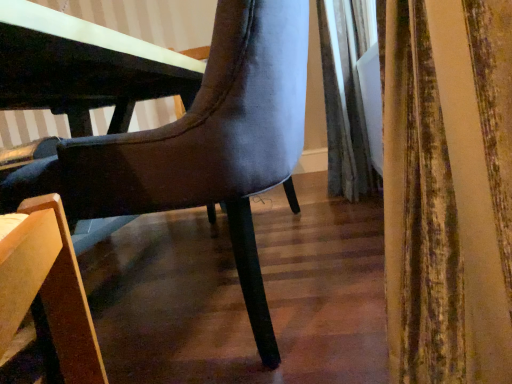
Question: From a real-world perspective, is velvet gray curtain at right physically above suede-like gray chair at center?

Choices:
 (A) yes
 (B) no

Answer: (A)

Question: Considering the relative sizes of velvet gray curtain at right and suede-like gray chair at center in the image provided, is velvet gray curtain at right bigger than suede-like gray chair at center?

Choices:
 (A) yes
 (B) no

Answer: (B)

Question: Can suede-like gray chair at center be found inside velvet gray curtain at right?

Choices:
 (A) no
 (B) yes

Answer: (A)

Question: Does velvet gray curtain at right have a lesser width compared to suede-like gray chair at center?

Choices:
 (A) yes
 (B) no

Answer: (A)

Question: Could you tell me if velvet gray curtain at right is turned towards suede-like gray chair at center?

Choices:
 (A) no
 (B) yes

Answer: (A)

Question: Is velvet gray curtain at right closer to the viewer compared to suede-like gray chair at center?

Choices:
 (A) no
 (B) yes

Answer: (A)

Question: Is the surface of suede-like gray chair at center in direct contact with velvet gray curtain at right?

Choices:
 (A) no
 (B) yes

Answer: (A)

Question: Are suede-like gray chair at center and velvet gray curtain at right far apart?

Choices:
 (A) yes
 (B) no

Answer: (A)

Question: From a real-world perspective, is suede-like gray chair at center under velvet gray curtain at right?

Choices:
 (A) yes
 (B) no

Answer: (A)

Question: Is suede-like gray chair at center taller than velvet gray curtain at right?

Choices:
 (A) no
 (B) yes

Answer: (A)

Question: From the image's perspective, is suede-like gray chair at center under velvet gray curtain at right?

Choices:
 (A) yes
 (B) no

Answer: (A)

Question: From the image's perspective, is suede-like gray chair at center over velvet gray curtain at right?

Choices:
 (A) yes
 (B) no

Answer: (B)

Question: Considering their positions, is velvet gray curtain at right located in front of or behind suede-like gray chair at center?

Choices:
 (A) behind
 (B) front

Answer: (A)